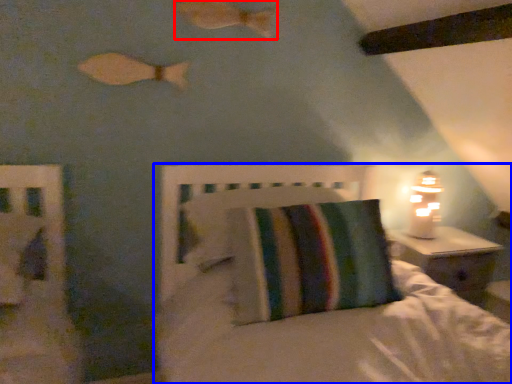
Question: Which object appears farthest to the camera in this image, fish (highlighted by a red box) or bed (highlighted by a blue box)?

Choices:
 (A) fish
 (B) bed

Answer: (A)